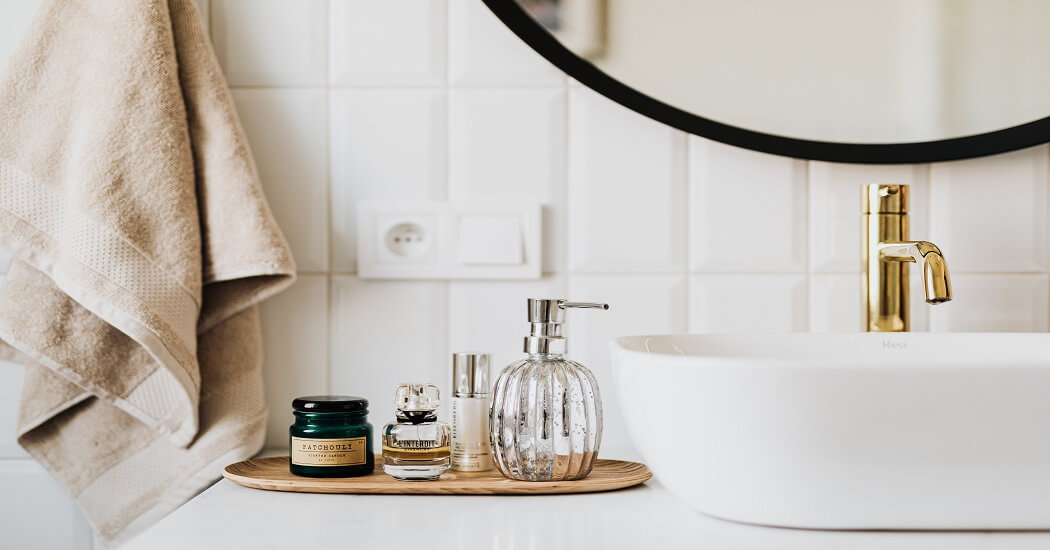
Locate an element on the screen. The height and width of the screenshot is (550, 1050). soap dispenser is located at coordinates (538, 431).